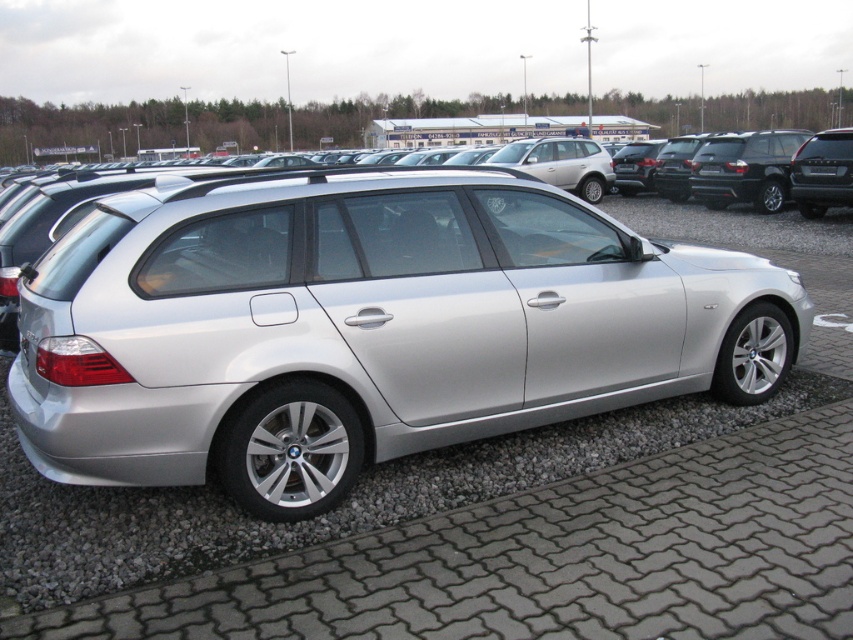
What do you see at coordinates (364, 326) in the screenshot?
I see `satin silver car at center` at bounding box center [364, 326].

Does point (286, 225) lie behind point (828, 173)?

That is False.

This screenshot has height=640, width=853. Identify the location of satin silver car at center. (364, 326).

Can you confirm if satin silver car at center is positioned to the right of satin black suv at upper right?

No, satin silver car at center is not to the right of satin black suv at upper right.

Based on the photo, between satin silver car at center and satin black suv at upper right, which one is positioned higher?

satin black suv at upper right

Who is more forward, (152, 241) or (807, 186)?

Point (152, 241) is in front.

Find the location of a particular element. This screenshot has height=640, width=853. satin silver car at center is located at coordinates (364, 326).

Who is taller, satin black suv at upper right or black plastic license plate at center?

satin black suv at upper right is taller.

Looking at this image, does satin black suv at upper right appear on the left side of black plastic license plate at center?

No, satin black suv at upper right is not to the left of black plastic license plate at center.

The height and width of the screenshot is (640, 853). Find the location of `satin black suv at upper right`. satin black suv at upper right is located at coordinates (822, 172).